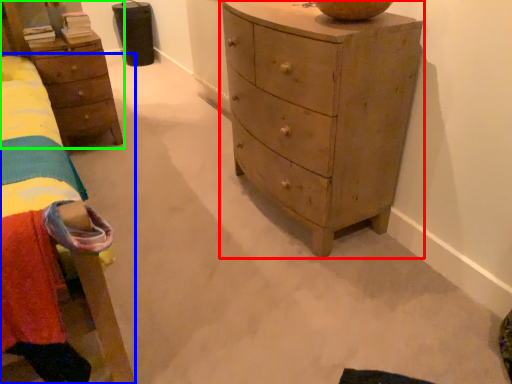
Question: Which object is positioned closest to chest of drawers (highlighted by a red box)? Select from bed (highlighted by a blue box) and nightstand (highlighted by a green box).

Choices:
 (A) bed
 (B) nightstand

Answer: (A)